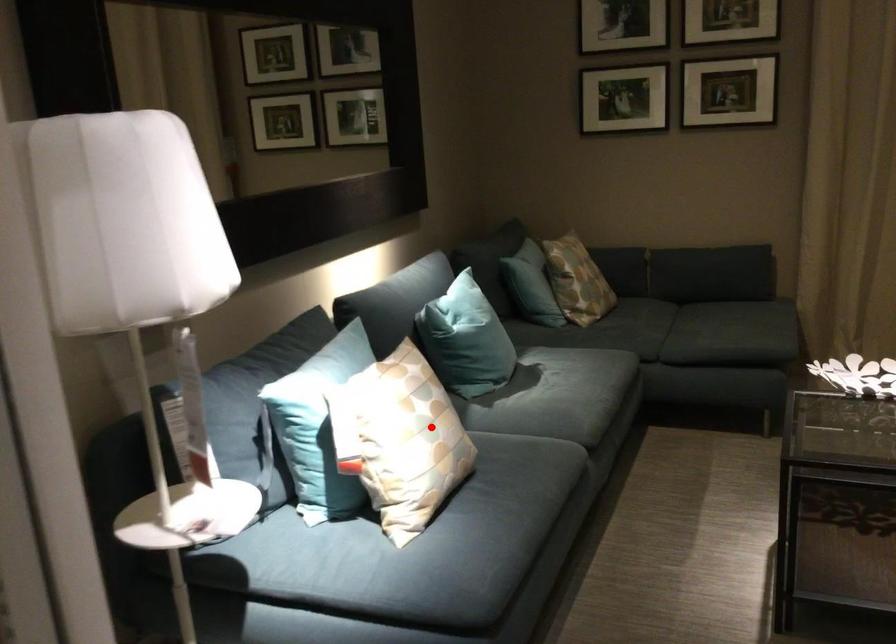
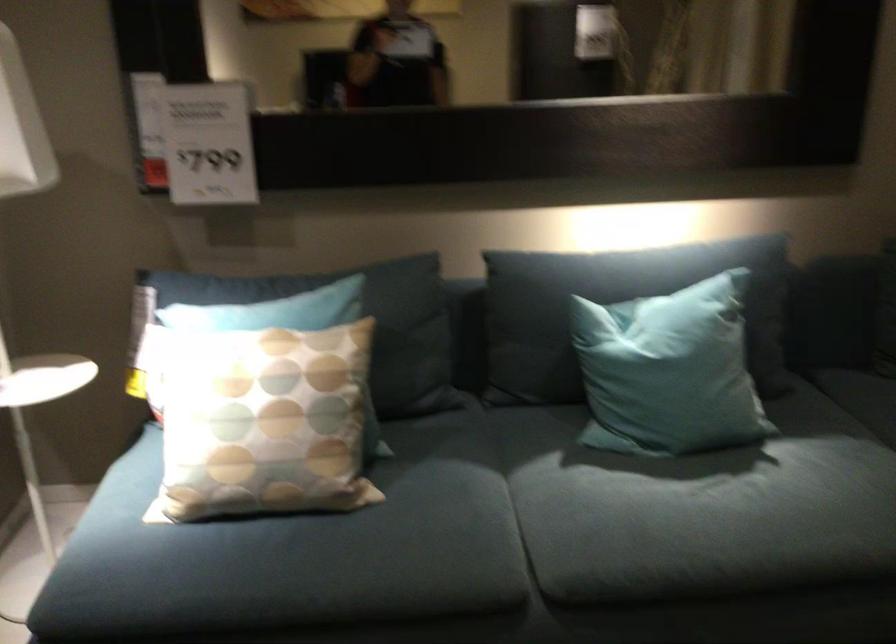
The point at the highlighted location is marked in the first image. Where is the corresponding point in the second image?

(263, 422)